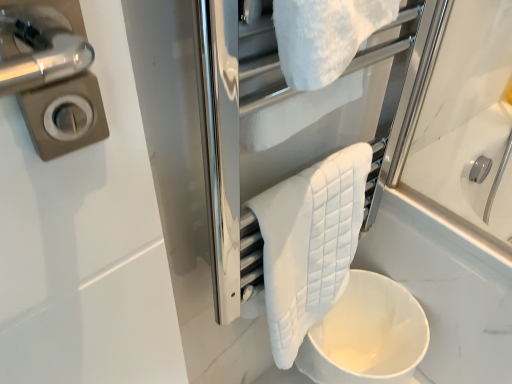
Question: Does point (274, 205) appear closer or farther from the camera than point (374, 192)?

Choices:
 (A) closer
 (B) farther

Answer: (A)

Question: Based on their sizes in the image, would you say white quilted towel at center is bigger or smaller than white quilted towel at upper center?

Choices:
 (A) big
 (B) small

Answer: (A)

Question: Which object is the farthest from the white quilted towel at upper center?

Choices:
 (A) white matte toilet bowl at lower center
 (B) white quilted towel at center

Answer: (A)

Question: Based on their relative distances, which object is farther from the white matte toilet bowl at lower center?

Choices:
 (A) white quilted towel at center
 (B) white quilted towel at upper center

Answer: (B)